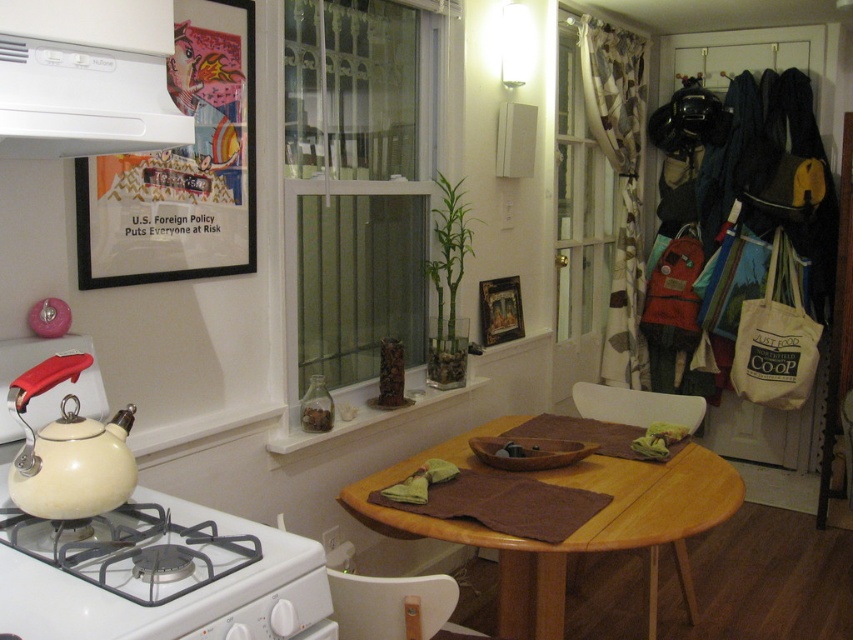
You are a delivery person who needs to place a camera on a shelf that is 1.07 meters away from the white plastic exhaust hood at upper left. Can you place it there?

The white plastic exhaust hood at upper left and camera are 1.07 meters apart, so yes, the camera can be placed on the shelf that is 1.07 meters away from the white plastic exhaust hood at upper left.

You are standing in the kitchen and want to reach both the point at coordinates point [523,584] and point [67,100]. Which point is closer to you?

Point [67,100] is closer to you because it is less further away than point [523,584].